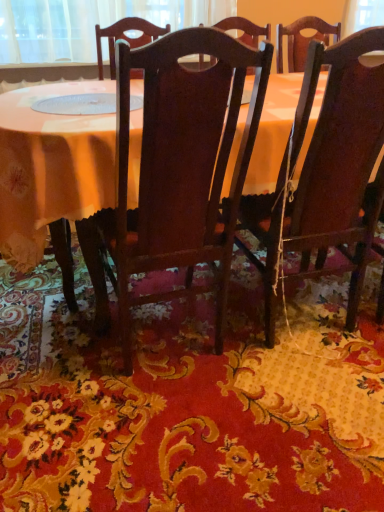
Where is `empty space that is to the right of dark wood chair at center, the first chair positioned from the left`? empty space that is to the right of dark wood chair at center, the first chair positioned from the left is located at coordinates (289, 383).